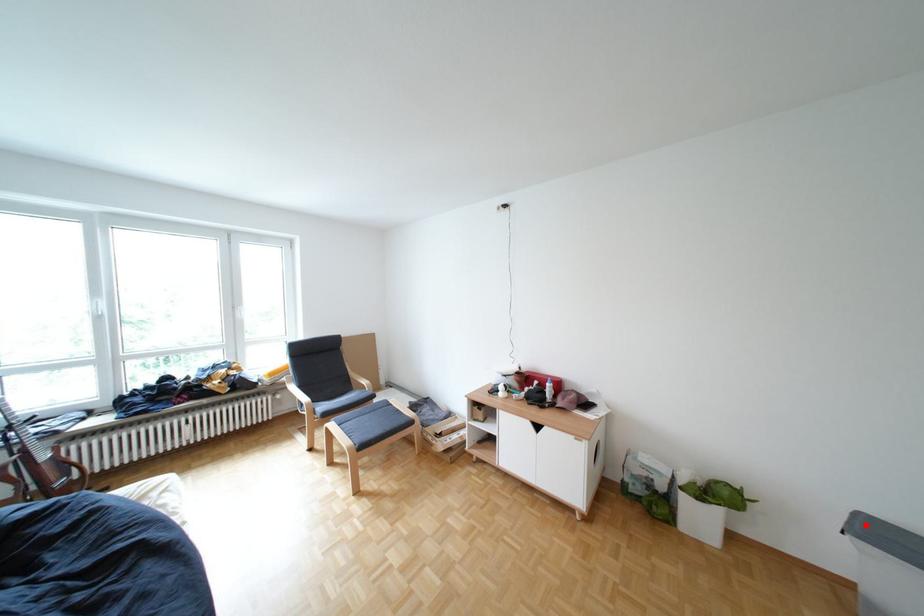
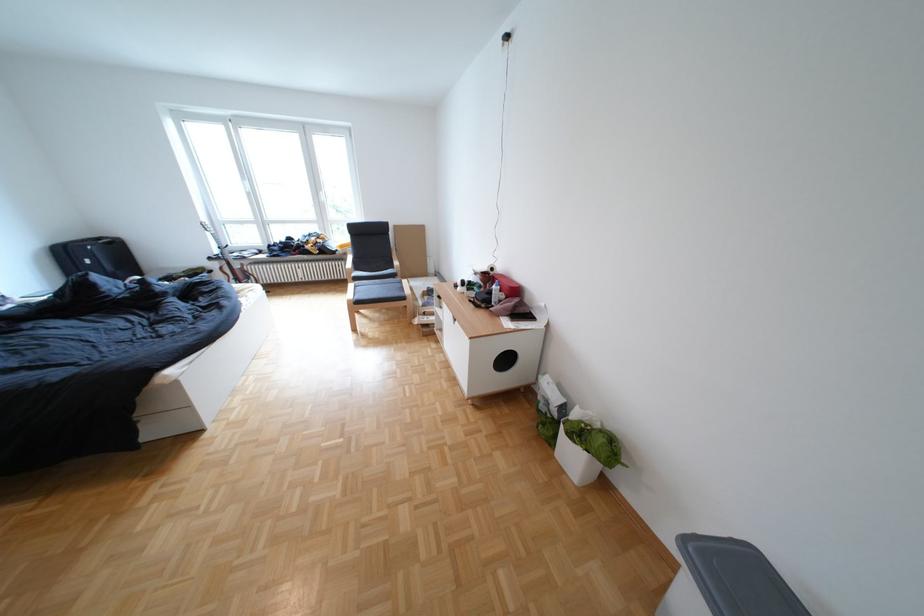
Question: I am providing you with two images of the same scene from different viewpoints. A red point is marked on the first image. At the location where the point appears in image 1, is it still visible in image 2?

Choices:
 (A) Yes
 (B) No

Answer: (A)